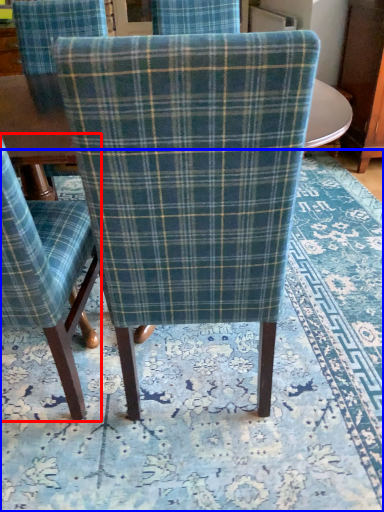
Question: Which object is closer to the camera taking this photo, chair (highlighted by a red box) or mat (highlighted by a blue box)?

Choices:
 (A) chair
 (B) mat

Answer: (A)